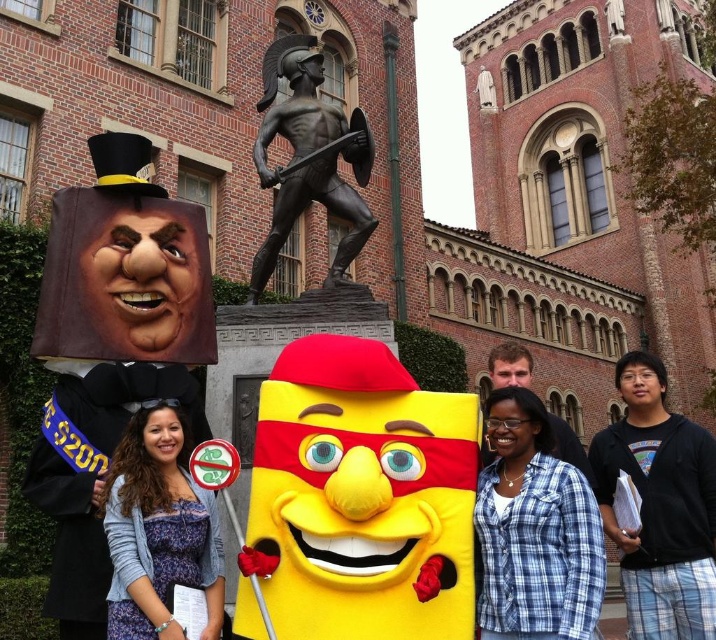
Question: Which object is positioned closest to the black cotton shirt at lower right?

Choices:
 (A) blue plaid shirt at lower right
 (B) matte purple dress at center

Answer: (A)

Question: Which is farther from the black cotton shirt at lower right?

Choices:
 (A) matte purple dress at center
 (B) blue plaid shirt at lower right
 (C) bronze warrior at center

Answer: (C)

Question: Considering the relative positions of blue plaid shirt at lower right and matte purple dress at center in the image provided, where is blue plaid shirt at lower right located with respect to matte purple dress at center?

Choices:
 (A) right
 (B) left

Answer: (A)

Question: Is blue plaid shirt at lower right wider than bronze warrior at center?

Choices:
 (A) no
 (B) yes

Answer: (A)

Question: Does black cotton shirt at lower right have a smaller size compared to bronze warrior at center?

Choices:
 (A) no
 (B) yes

Answer: (B)

Question: Which object is farther from the camera taking this photo?

Choices:
 (A) blue plaid shirt at lower right
 (B) matte purple dress at center
 (C) black cotton shirt at lower right

Answer: (C)